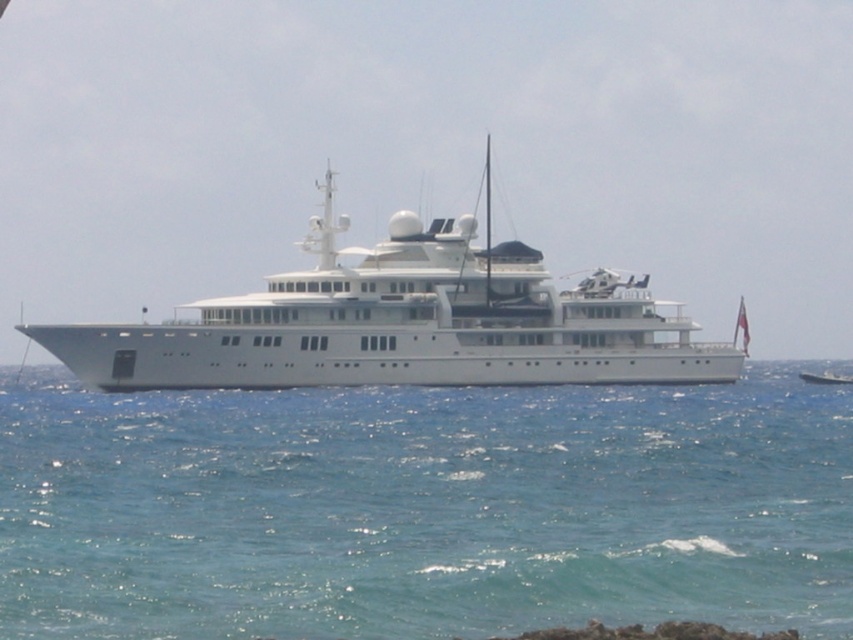
Question: Can you confirm if clear blue water at center is positioned above white glossy cruise ship at center?

Choices:
 (A) no
 (B) yes

Answer: (A)

Question: Which point is closer to the camera?

Choices:
 (A) clear blue water at center
 (B) white glossy cruise ship at center

Answer: (A)

Question: Which point appears closest to the camera in this image?

Choices:
 (A) (410, 316)
 (B) (479, 449)
 (C) (811, 374)

Answer: (B)

Question: Can you confirm if white glossy cruise ship at center is positioned to the right of white glossy yacht at center?

Choices:
 (A) yes
 (B) no

Answer: (B)

Question: Which point is closer to the camera taking this photo?

Choices:
 (A) (418, 456)
 (B) (524, 353)

Answer: (A)

Question: Is clear blue water at center below white glossy cruise ship at center?

Choices:
 (A) yes
 (B) no

Answer: (A)